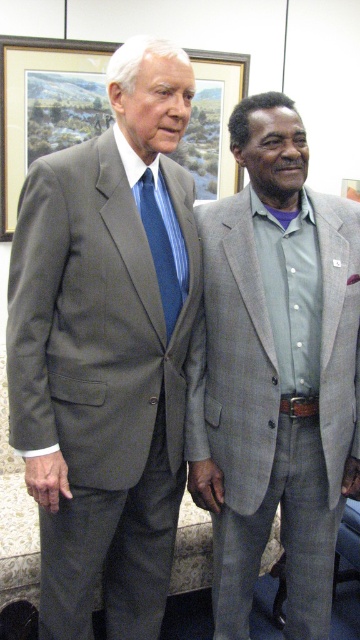
In the scene shown: Which is above, gray textured suit at center or brushed metal picture frame at upper center?

brushed metal picture frame at upper center

I want to click on gray textured suit at center, so click(277, 371).

Does gray textured suit at center appear on the left side of blue striped tie at center?

In fact, gray textured suit at center is to the right of blue striped tie at center.

Which is in front, point (231, 484) or point (165, 257)?

Point (165, 257) is more forward.

Is point (239, 211) less distant than point (162, 240)?

No, it is not.

Identify the location of gray textured suit at center. (277, 371).

Which is above, matte gray suit at left or gray textured suit at center?

Positioned higher is matte gray suit at left.

Locate an element on the screen. matte gray suit at left is located at coordinates (110, 349).

The height and width of the screenshot is (640, 360). Identify the location of matte gray suit at left. (110, 349).